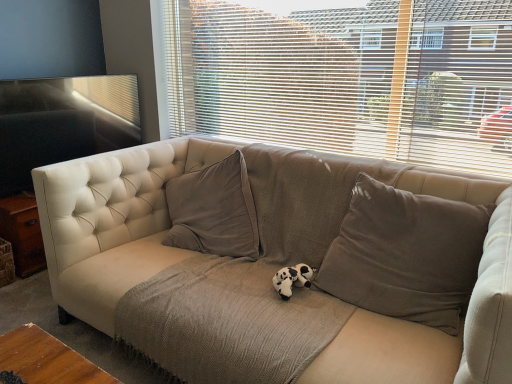
Describe the element at coordinates (23, 232) in the screenshot. The image size is (512, 384). I see `matte wood table at left` at that location.

Find the location of a particular element. This screenshot has height=384, width=512. beige fabric blinds at upper center is located at coordinates (349, 78).

The width and height of the screenshot is (512, 384). What do you see at coordinates (349, 78) in the screenshot? I see `beige fabric blinds at upper center` at bounding box center [349, 78].

The image size is (512, 384). What do you see at coordinates (112, 221) in the screenshot?
I see `beige fabric couch at center` at bounding box center [112, 221].

What is the approximate width of black plush toy at center?

black plush toy at center is 21.43 centimeters wide.

The image size is (512, 384). Identify the location of matte wood table at left. coord(23,232).

Considering the relative positions of black plush toy at center and matte wood table at left in the image provided, is black plush toy at center to the left of matte wood table at left from the viewer's perspective?

No.

Is black plush toy at center positioned beyond the bounds of matte wood table at left?

That's correct, black plush toy at center is outside of matte wood table at left.

Which is less distant, [289,267] or [0,236]?

The point [289,267] is in front.

From the image's perspective, is beige fabric couch at center above or below brown fabric pillow at center?

Clearly, from the image's perspective, beige fabric couch at center is below brown fabric pillow at center.

Between beige fabric couch at center and brown fabric pillow at center, which one has smaller size?

brown fabric pillow at center is smaller.

Is brown fabric pillow at center a part of beige fabric couch at center?

Yes, beige fabric couch at center is surrounding brown fabric pillow at center.

In the scene shown: Can you confirm if beige fabric couch at center is wider than brown fabric pillow at center?

Correct, the width of beige fabric couch at center exceeds that of brown fabric pillow at center.

From the image's perspective, who appears lower, beige fabric blinds at upper center or beige fabric couch at center?

beige fabric couch at center, from the image's perspective.

There is a beige fabric couch at center. In order to click on window blind above it (from a real-world perspective) in this screenshot , I will do `click(349, 78)`.

From a real-world perspective, who is located higher, beige fabric blinds at upper center or beige fabric couch at center?

From a 3D spatial view, beige fabric blinds at upper center is above.

Would you say beige fabric blinds at upper center contains beige fabric couch at center?

That's incorrect, beige fabric couch at center is not inside beige fabric blinds at upper center.

Image resolution: width=512 pixels, height=384 pixels. I want to click on animal behind the beige fabric couch at center, so pyautogui.click(x=292, y=279).

Which object is positioned more to the right, black plush toy at center or beige fabric couch at center?

From the viewer's perspective, black plush toy at center appears more on the right side.

From a real-world perspective, does black plush toy at center sit lower than beige fabric couch at center?

Correct, in the physical world, black plush toy at center is lower than beige fabric couch at center.

Could you tell me if black plush toy at center is facing beige fabric couch at center?

Yes, black plush toy at center is facing beige fabric couch at center.

Is beige fabric blinds at upper center at the back of brown fabric pillow at center?

That's not correct — brown fabric pillow at center is not looking away from beige fabric blinds at upper center.

In terms of size, does brown fabric pillow at center appear bigger or smaller than beige fabric blinds at upper center?

Clearly, brown fabric pillow at center is larger in size than beige fabric blinds at upper center.

Which object is positioned more to the left, brown fabric pillow at center or beige fabric blinds at upper center?

Positioned to the left is beige fabric blinds at upper center.

Is brown fabric pillow at center facing away from matte wood table at left?

That's not correct — brown fabric pillow at center is not looking away from matte wood table at left.

Between point (448, 317) and point (8, 226), which one is positioned behind?

The point (8, 226) is behind.

Is brown fabric pillow at center directly adjacent to matte wood table at left?

brown fabric pillow at center and matte wood table at left are not in contact.

Is brown fabric pillow at center smaller than matte wood table at left?

Incorrect, brown fabric pillow at center is not smaller in size than matte wood table at left.

Is beige fabric couch at center further to the viewer compared to beige fabric blinds at upper center?

No, it is in front of beige fabric blinds at upper center.

Is beige fabric couch at center completely or partially outside of beige fabric blinds at upper center?

Yes, beige fabric couch at center is not within beige fabric blinds at upper center.

At what (x,y) coordinates should I click in order to perform the action: click on animal lying on the right of matte wood table at left. Please return your answer as a coordinate pair (x, y). This screenshot has width=512, height=384. Looking at the image, I should click on [x=292, y=279].

Image resolution: width=512 pixels, height=384 pixels. Identify the location of studio couch lying in front of the brown fabric pillow at center. (112, 221).

When comparing their distances from black plush toy at center, does beige fabric blinds at upper center or beige fabric couch at center seem closer?

beige fabric couch at center is positioned closer to the anchor black plush toy at center.

Estimate the real-world distances between objects in this image. Which object is further from beige fabric couch at center, beige fabric blinds at upper center or matte wood table at left?

Based on the image, beige fabric blinds at upper center appears to be further to beige fabric couch at center.

Based on their spatial positions, is beige fabric couch at center or black plush toy at center closer to matte wood table at left?

Among the two, beige fabric couch at center is located nearer to matte wood table at left.

Looking at the image, which one is located further to brown fabric pillow at center, beige fabric blinds at upper center or black plush toy at center?

Based on the image, beige fabric blinds at upper center appears to be further to brown fabric pillow at center.

Which object lies nearer to the anchor point brown fabric pillow at center, black plush toy at center or beige fabric blinds at upper center?

black plush toy at center.

Estimate the real-world distances between objects in this image. Which object is further from matte wood table at left, brown fabric pillow at center or beige fabric blinds at upper center?

brown fabric pillow at center is further to matte wood table at left.

From the image, which object appears to be nearer to black plush toy at center, matte wood table at left or beige fabric couch at center?

beige fabric couch at center is closer to black plush toy at center.

From the image, which object appears to be nearer to black plush toy at center, beige fabric blinds at upper center or brown fabric pillow at center?

Based on the image, brown fabric pillow at center appears to be nearer to black plush toy at center.

Locate an element on the screen. studio couch between beige fabric blinds at upper center and black plush toy at center in the vertical direction is located at coordinates (112, 221).

The width and height of the screenshot is (512, 384). In order to click on pillow between beige fabric blinds at upper center and beige fabric couch at center from top to bottom in this screenshot , I will do click(406, 254).

The width and height of the screenshot is (512, 384). What are the coordinates of `animal between beige fabric couch at center and brown fabric pillow at center` in the screenshot? It's located at (292, 279).

I want to click on studio couch between matte wood table at left and brown fabric pillow at center in the horizontal direction, so click(112, 221).